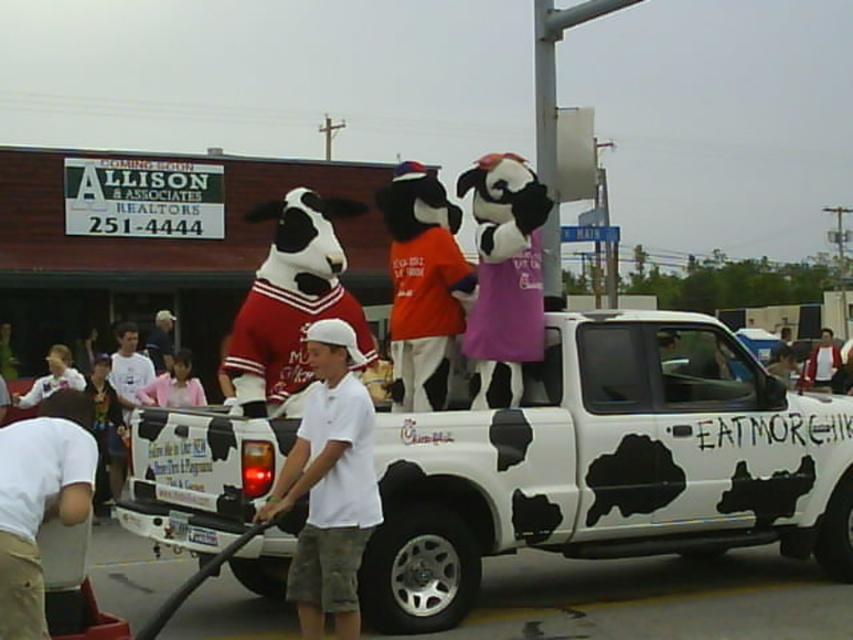
Does cow-printed truck at center come in front of white cotton shirt at lower left?

No, cow-printed truck at center is behind white cotton shirt at lower left.

Consider the image. Can you confirm if cow-printed truck at center is taller than white cotton shirt at lower left?

Yes.

Which is behind, point (654, 352) or point (82, 449)?

The point (654, 352) is more distant.

Find the location of a particular element. cow-printed truck at center is located at coordinates (608, 465).